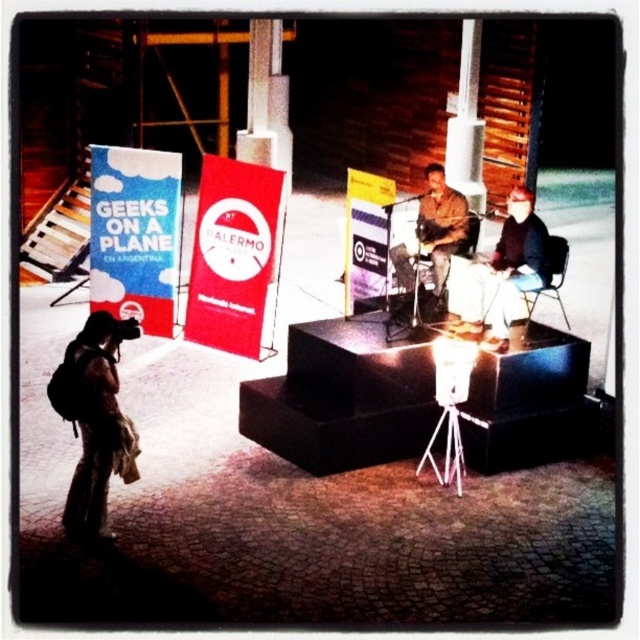
Question: Does brown backpack at lower left have a lesser width compared to leather jacket at center?

Choices:
 (A) yes
 (B) no

Answer: (A)

Question: Which point appears closest to the camera in this image?

Choices:
 (A) (444, 179)
 (B) (97, 440)

Answer: (B)

Question: Is brown backpack at lower left below leather jacket at center?

Choices:
 (A) no
 (B) yes

Answer: (B)

Question: Is brown backpack at lower left wider than leather jacket at center?

Choices:
 (A) no
 (B) yes

Answer: (A)